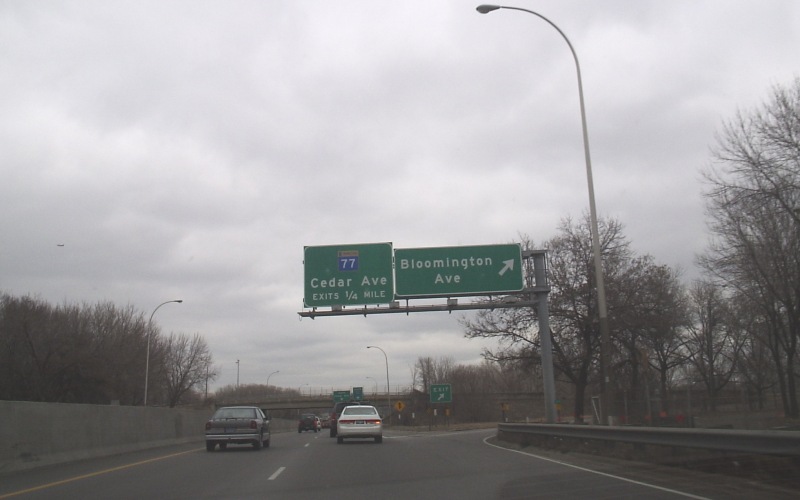
Identify the location of light gray lamp. (590, 189), (482, 6).